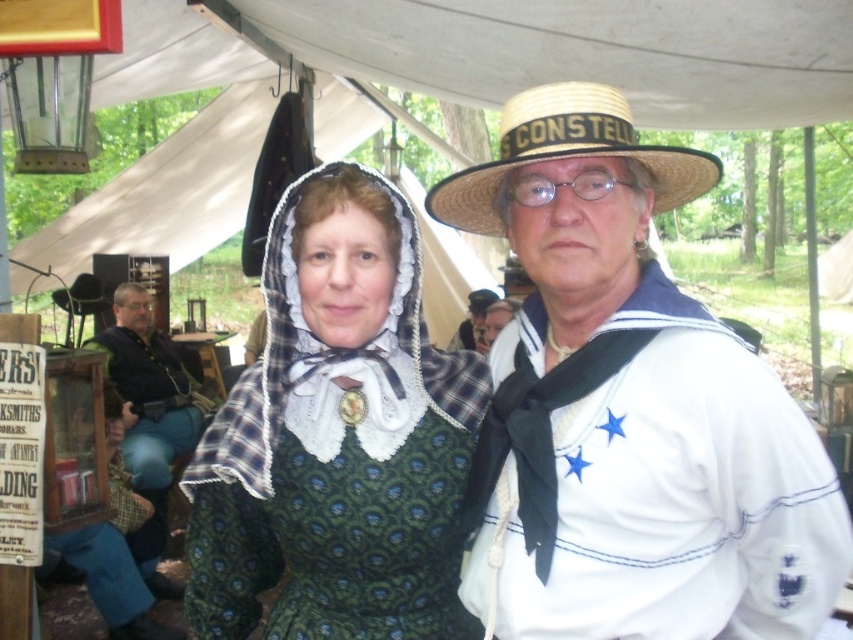
Can you confirm if dark blue denim pants at left is positioned to the left of sailor hat at upper center?

Yes, dark blue denim pants at left is to the left of sailor hat at upper center.

Which is more to the right, dark blue denim pants at left or sailor hat at upper center?

From the viewer's perspective, sailor hat at upper center appears more on the right side.

Between point (165, 582) and point (483, 296), which one is positioned behind?

Positioned behind is point (483, 296).

The width and height of the screenshot is (853, 640). I want to click on dark blue denim pants at left, so [149, 416].

Who is positioned more to the left, matte green dress at center or sailor hat at upper center?

Positioned to the left is matte green dress at center.

The image size is (853, 640). Identify the location of matte green dress at center. (628, 410).

Can you confirm if green plaid dress at center is positioned above dark blue denim pants at left?

Indeed, green plaid dress at center is positioned over dark blue denim pants at left.

How distant is green plaid dress at center from dark blue denim pants at left?

green plaid dress at center and dark blue denim pants at left are 3.31 meters apart from each other.

Identify the location of green plaid dress at center. (335, 456).